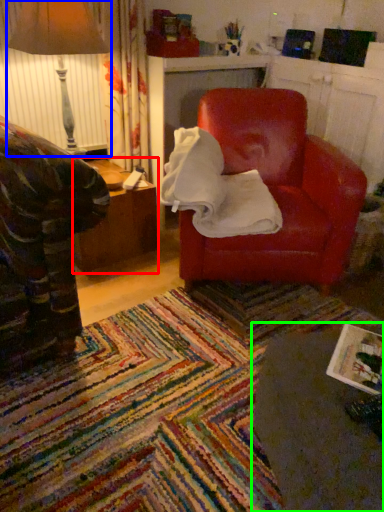
Question: Estimate the real-world distances between objects in this image. Which object is closer to table (highlighted by a red box), table lamp (highlighted by a blue box) or table (highlighted by a green box)?

Choices:
 (A) table lamp
 (B) table

Answer: (A)